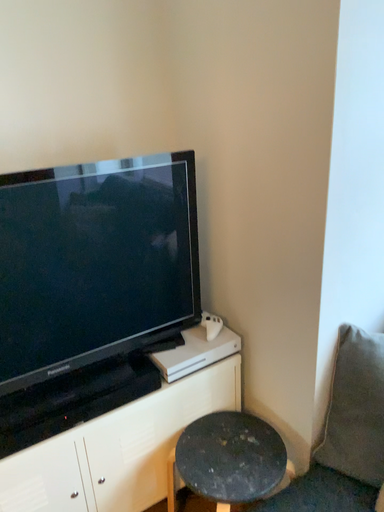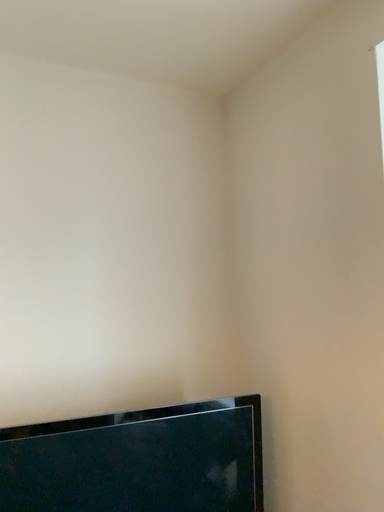
Question: Which way did the camera rotate in the video?

Choices:
 (A) rotated downward
 (B) rotated upward

Answer: (B)